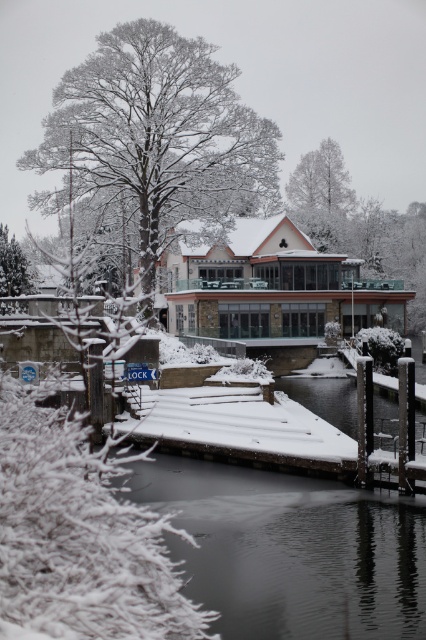
Question: Estimate the real-world distances between objects in this image. Which object is closer to the smooth ice river at lower center?

Choices:
 (A) white frosty tree at upper center
 (B) green matte tree at upper left

Answer: (B)

Question: Is smooth ice river at lower center closer to the viewer compared to snow-covered tree at upper center?

Choices:
 (A) no
 (B) yes

Answer: (B)

Question: Can you confirm if smooth ice river at lower center is bigger than white frosty tree at upper center?

Choices:
 (A) yes
 (B) no

Answer: (B)

Question: Which point is closer to the camera?

Choices:
 (A) green matte tree at upper left
 (B) snow-covered tree at upper center
 (C) white frosty tree at upper center
 (D) smooth ice river at lower center

Answer: (D)

Question: Which point is farther from the camera taking this photo?

Choices:
 (A) [184, 141]
 (B) [258, 625]

Answer: (A)

Question: Does smooth ice river at lower center have a greater width compared to snow-covered tree at upper center?

Choices:
 (A) no
 (B) yes

Answer: (A)